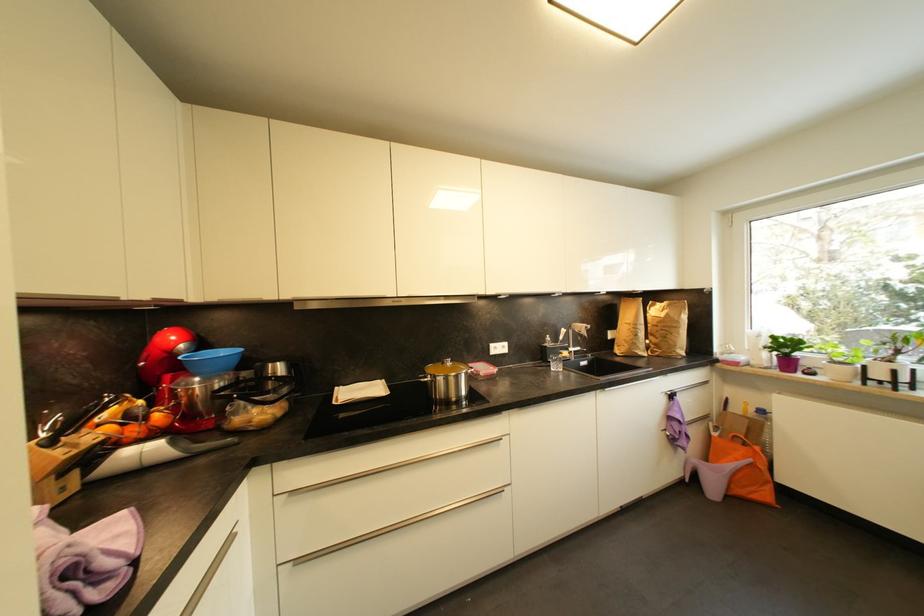
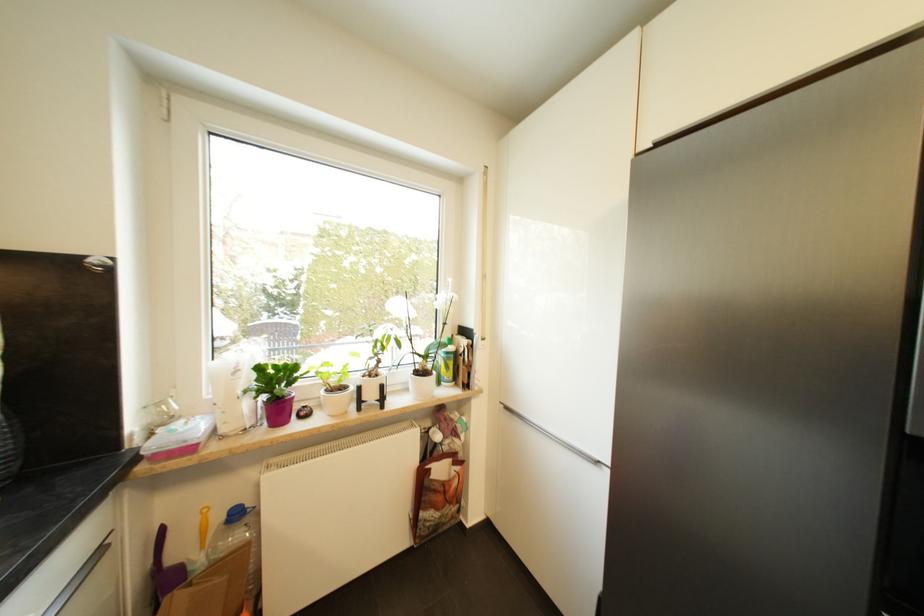
Find the pixel in the second image that matches (x=711, y=384) in the first image.

(105, 553)